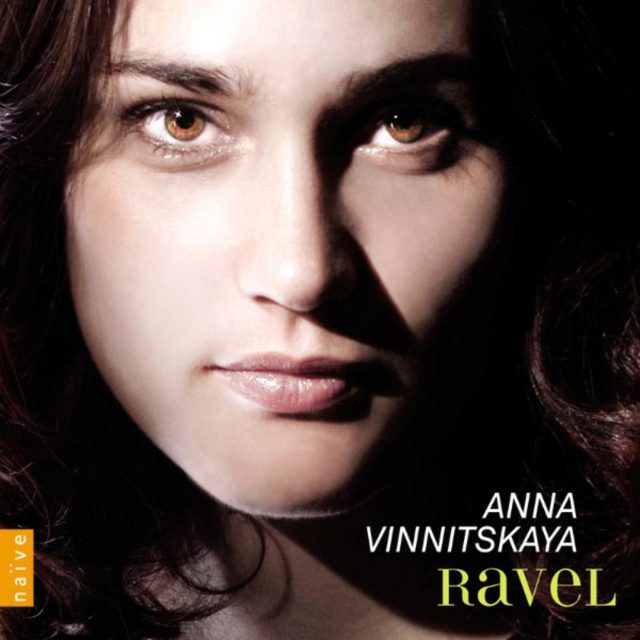
You are an artist analyzing the album cover. You notice two eyes in the portrait. The brown glossy eye at upper center and the brown matte eye at upper left. Which eye appears larger in the image?

The brown glossy eye at upper center appears larger than the brown matte eye at upper left.

Where is the smooth skin face at center located in the image?

The smooth skin face at center is located at point coordinates of (280,243).

You are holding a ruler and want to measure the distance between the text in the bottom right corner and yourself. The text is located at point (168, 22). Can you estimate how far it is from you to that text?

The distance between point (168, 22) and the viewer is 13.69 inches, so the text is approximately 13.69 inches away from you.